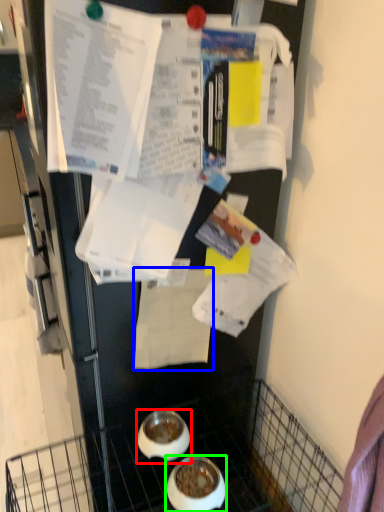
Question: Considering the real-world distances, which object is farthest from bowl (highlighted by a red box)? paper (highlighted by a blue box) or bowl (highlighted by a green box)?

Choices:
 (A) paper
 (B) bowl

Answer: (A)